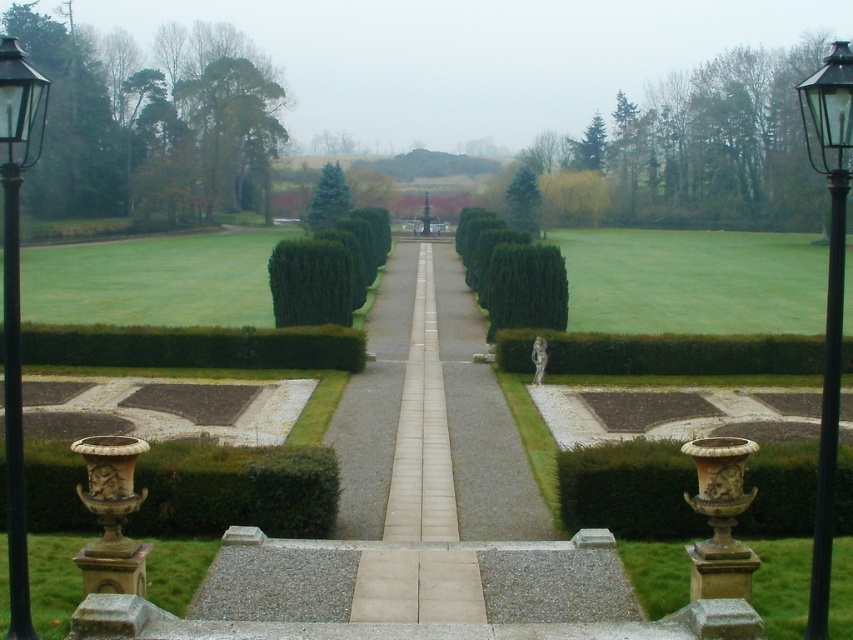
Question: Which object is the farthest from the brown stone vase at lower right?

Choices:
 (A) green textured hedge at lower left
 (B) light beige stone path at center
 (C) green glossy hedge at center

Answer: (C)

Question: Among these points, which one is farthest from the camera?

Choices:
 (A) (807, 128)
 (B) (517, 369)

Answer: (A)

Question: Is green hedge at center below green matte hedge at center?

Choices:
 (A) yes
 (B) no

Answer: (A)

Question: Is green leafy hedge at center wider than black metal street light at left?

Choices:
 (A) no
 (B) yes

Answer: (A)

Question: Is green hedge at center closer to the viewer compared to light beige stone path at center?

Choices:
 (A) yes
 (B) no

Answer: (B)

Question: Based on their relative distances, which object is farther from the green hedge at center?

Choices:
 (A) brown stone vase at lower right
 (B) green textured hedge at lower left

Answer: (B)